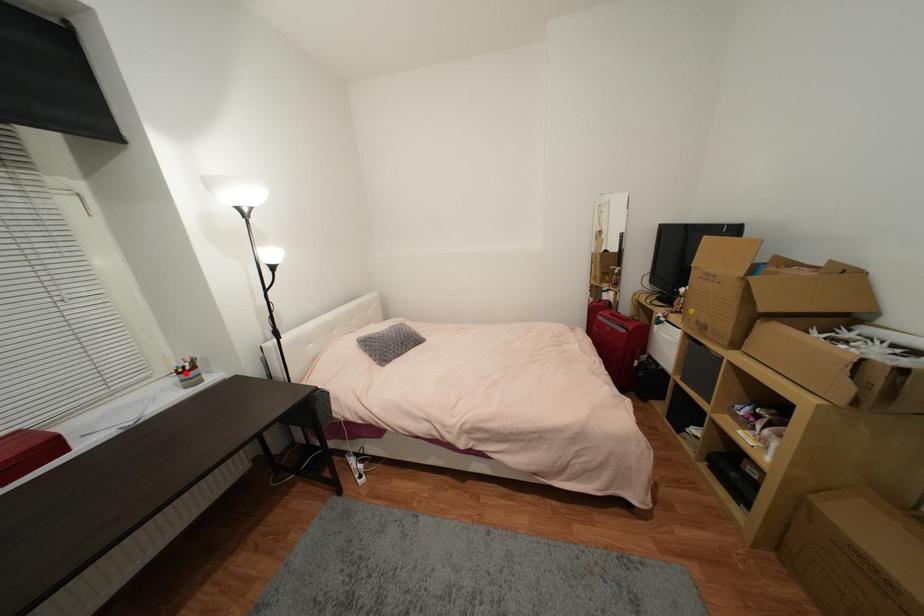
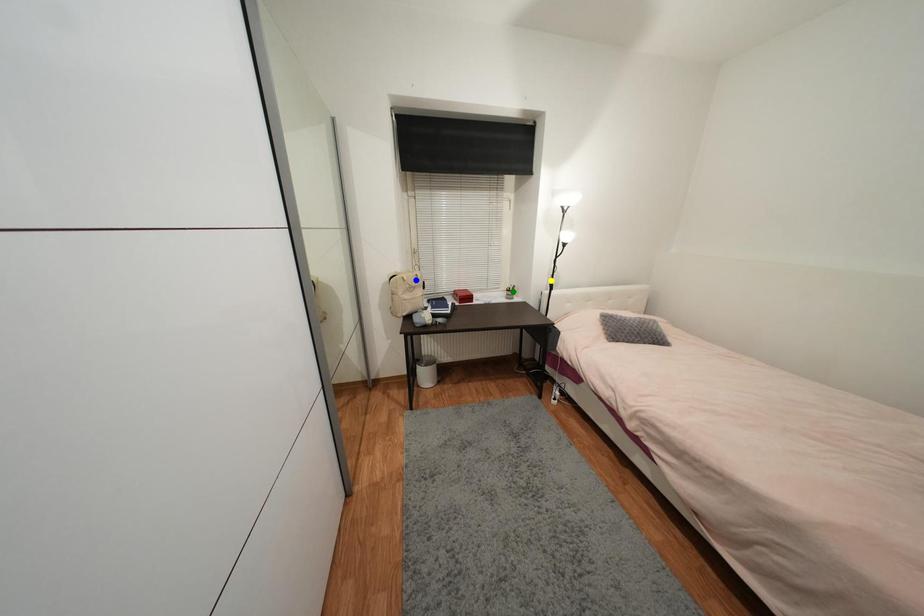
Question: I am providing you with two images of the same scene from different viewpoints. A red point is marked on the first image. You are given multiple points on the second image. Which mark in image 2 goes with the point in image 1?

Choices:
 (A) green point
 (B) blue point
 (C) yellow point

Answer: (A)